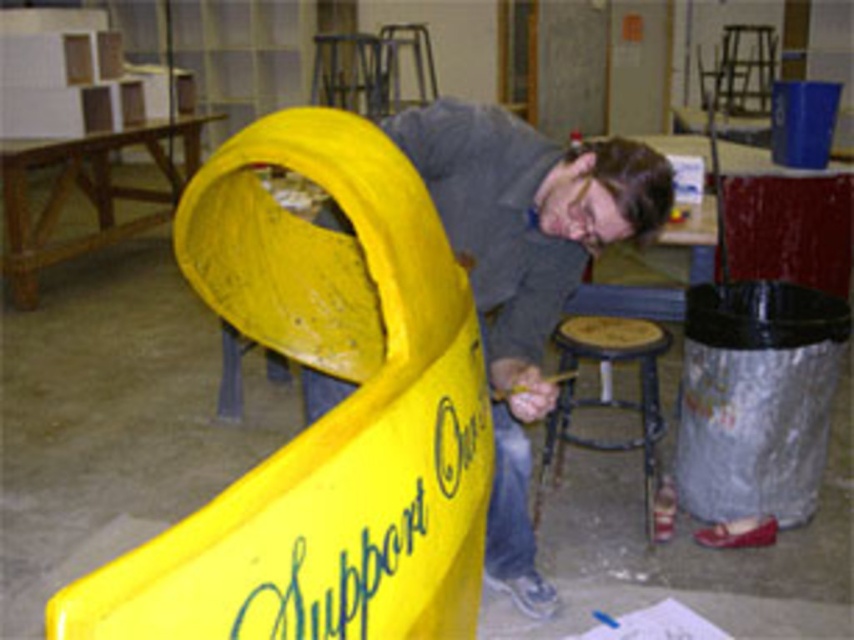
Can you confirm if yellow plastic slide at left is wider than matte yellow bucket at center?

No.

Who is positioned more to the right, yellow plastic slide at left or matte yellow bucket at center?

matte yellow bucket at center is more to the right.

Who is more forward, (268,461) or (583,182)?

Point (268,461) is more forward.

You are a GUI agent. You are given a task and a screenshot of the screen. Output one action in this format:
    pyautogui.click(x=<x>, y=<y>)
    Task: Click on the yellow plastic slide at left
    The height and width of the screenshot is (640, 854).
    Given the screenshot: What is the action you would take?
    pyautogui.click(x=325, y=416)

Does point (661, 192) come farther from viewer compared to point (647, 353)?

That is False.

Is point (581, 170) positioned in front of point (641, 362)?

Yes, it is in front of point (641, 362).

The height and width of the screenshot is (640, 854). What do you see at coordinates (524, 272) in the screenshot? I see `matte yellow bucket at center` at bounding box center [524, 272].

The height and width of the screenshot is (640, 854). I want to click on matte yellow bucket at center, so click(x=524, y=272).

Between point (383, 595) and point (553, 416), which one is positioned in front?

Point (383, 595) is more forward.

Does yellow plastic slide at left come in front of wooden stool at lower center?

Yes, yellow plastic slide at left is closer to the viewer.

What do you see at coordinates (325, 416) in the screenshot? I see `yellow plastic slide at left` at bounding box center [325, 416].

This screenshot has width=854, height=640. What are the coordinates of `yellow plastic slide at left` in the screenshot? It's located at (325, 416).